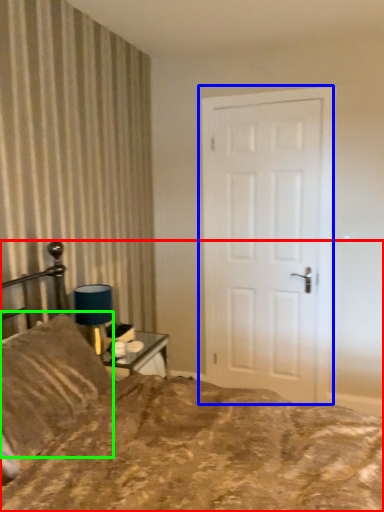
Question: Based on their relative distances, which object is nearer to bed (highlighted by a red box)? Choose from door (highlighted by a blue box) and pillow (highlighted by a green box).

Choices:
 (A) door
 (B) pillow

Answer: (B)